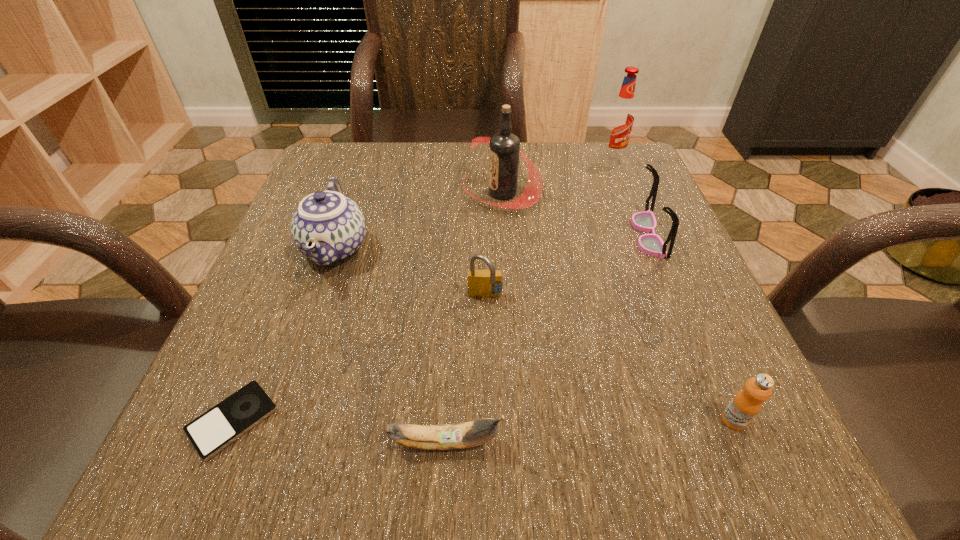
What are the coordinates of `the right root beer` in the screenshot? It's located at (620, 119).

This screenshot has height=540, width=960. What are the coordinates of `the farther root beer` in the screenshot? It's located at (620, 119).

The height and width of the screenshot is (540, 960). Identify the location of the nearer root beer. (504, 149).

Image resolution: width=960 pixels, height=540 pixels. I want to click on chinaware, so click(x=327, y=227).

Locate an element on the screen. The image size is (960, 540). spectacles is located at coordinates (651, 244).

The image size is (960, 540). What are the coordinates of `the fourth nearest object` in the screenshot? It's located at (481, 283).

This screenshot has width=960, height=540. Identify the location of orange juice. (746, 404).

The image size is (960, 540). Find the location of `the second shortest object`. the second shortest object is located at coordinates (468, 434).

The height and width of the screenshot is (540, 960). In order to click on the shortest object in this screenshot , I will do `click(211, 432)`.

At what (x,y) coordinates should I click in order to perform the action: click on free space located on the front of the right root beer. Please return your answer as a coordinate pair (x, y). Looking at the image, I should click on (633, 211).